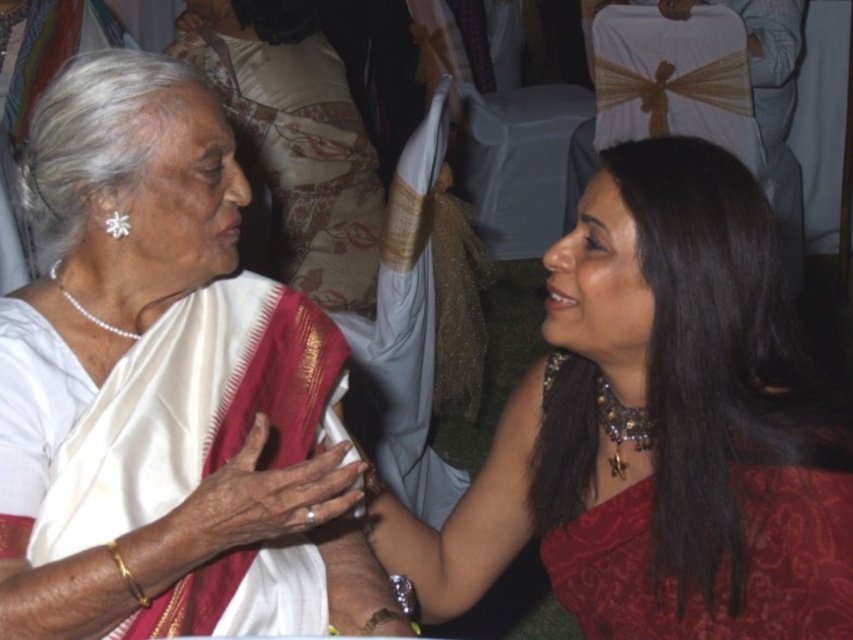
From the picture: What is located at the coordinates point (165, 390) in the image?

At point (165, 390) lies white silk saree at center.

You are a photographer at the event and want to focus on the white silk saree at center. There is a point marked at coordinates point (165, 390). Is this point located on the white silk saree at center?

Yes, the point (165, 390) is on the white silk saree at center according to the description.

You are organizing a fashion show and need to decide the order of the models based on the size of their outfits. If you have the white silk saree at center and the red satin dress at right, which outfit should come first if you want to arrange them from largest to smallest?

The white silk saree at center should come first because it is bigger than the red satin dress at right.